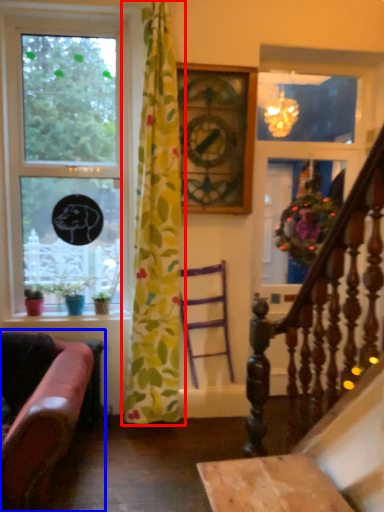
Question: Among these objects, which one is nearest to the camera, curtain (highlighted by a red box) or studio couch (highlighted by a blue box)?

Choices:
 (A) curtain
 (B) studio couch

Answer: (B)